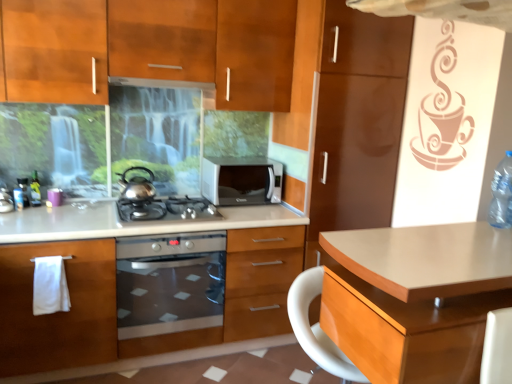
Identify the location of free region on the left part of clear plastic bottle at right, placed as the second bottle when sorted from left to right. (475, 226).